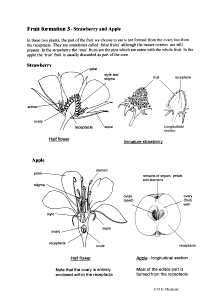
Locate an element on the screen. bulb is located at coordinates (172, 108).